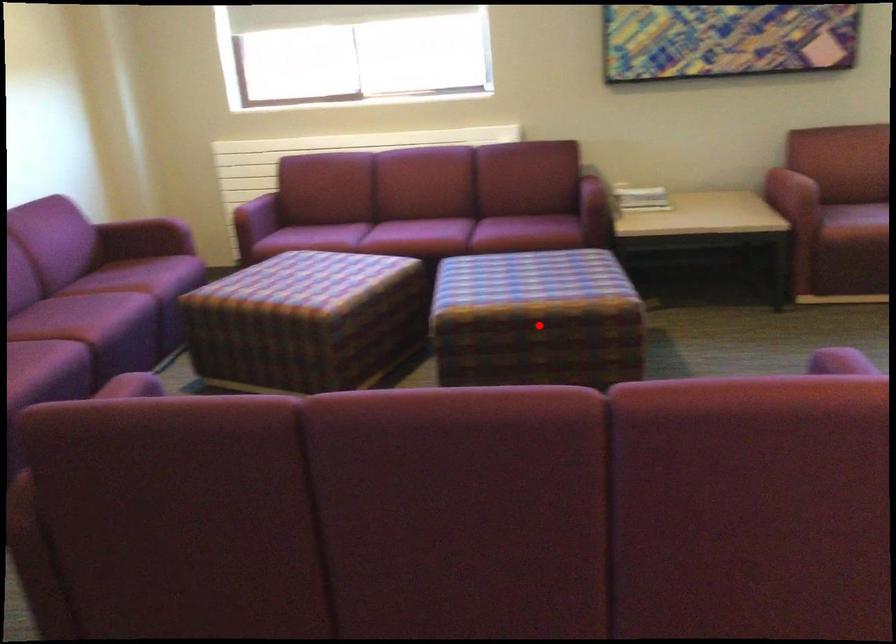
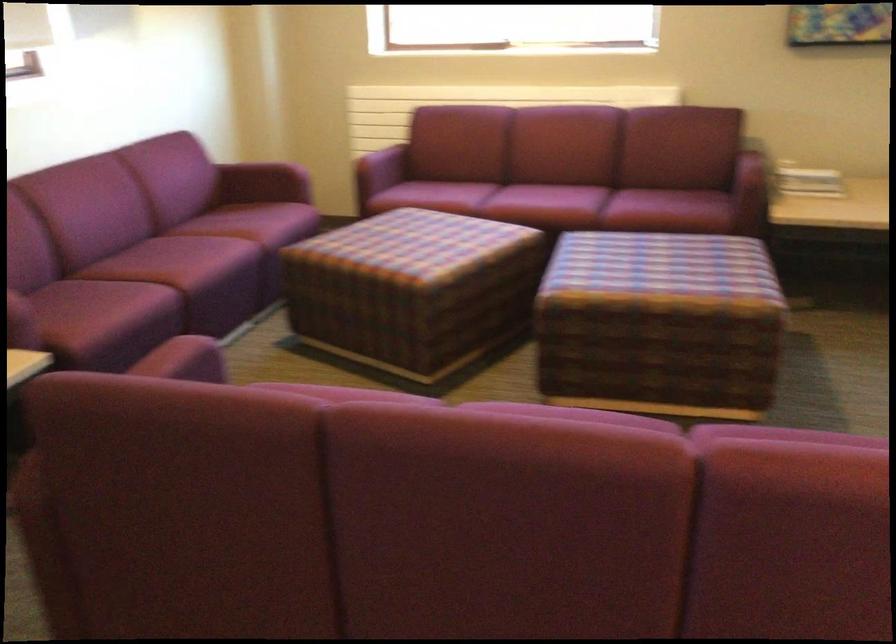
In the second image, find the point that corresponds to the highlighted location in the first image.

(659, 324)